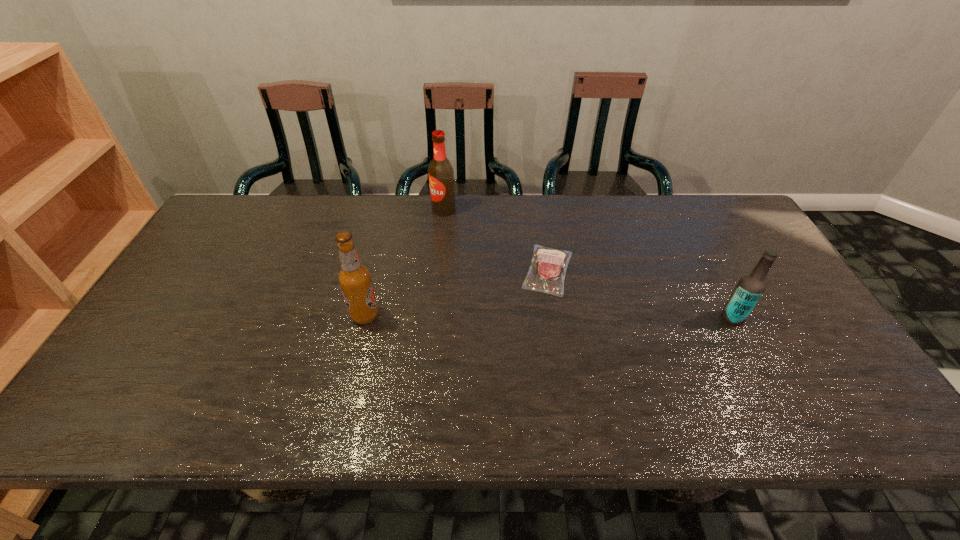
Where is `free space between the rightmost object and the leftmost beer bottle`? This screenshot has width=960, height=540. free space between the rightmost object and the leftmost beer bottle is located at coordinates (549, 316).

Identify the location of the closest object to the leftmost object. (546, 274).

Locate which object is the third closest to the rightmost beer bottle. Please provide its 2D coordinates. Your answer should be formatted as a tuple, i.e. [(x, y)], where the tuple contains the x and y coordinates of a point satisfying the conditions above.

[(354, 278)]

Where is `beer bottle that is the closest to the second beer bottle from right to left`? The image size is (960, 540). beer bottle that is the closest to the second beer bottle from right to left is located at coordinates (354, 278).

Identify which beer bottle is the third closest to the shortest object. Please provide its 2D coordinates. Your answer should be formatted as a tuple, i.e. [(x, y)], where the tuple contains the x and y coordinates of a point satisfying the conditions above.

[(354, 278)]